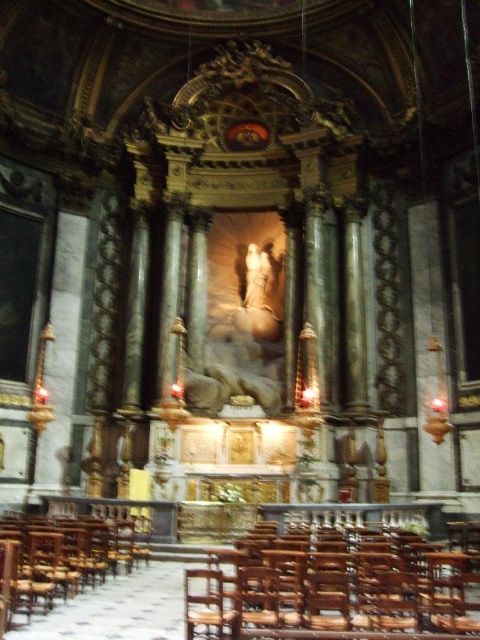
Question: Does wooden polished chair at lower center have a larger size compared to wooden chair at left?

Choices:
 (A) yes
 (B) no

Answer: (A)

Question: Is wooden polished chair at lower center below wooden chair at left?

Choices:
 (A) no
 (B) yes

Answer: (B)

Question: Which object is farther from the camera taking this photo?

Choices:
 (A) wooden chair at left
 (B) wooden polished chair at lower center

Answer: (A)

Question: Which object is closer to the camera taking this photo?

Choices:
 (A) wooden polished chair at lower center
 (B) wooden chair at left

Answer: (A)

Question: Is wooden polished chair at lower center positioned before wooden chair at left?

Choices:
 (A) yes
 (B) no

Answer: (A)